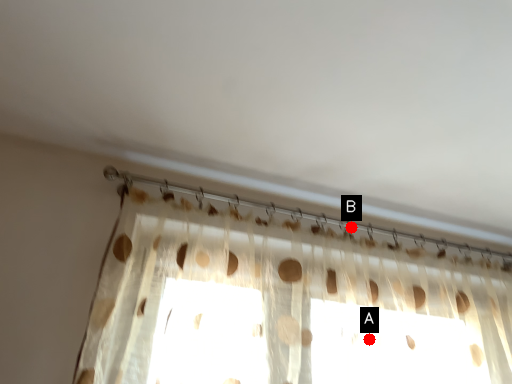
Question: Two points are circled on the image, labeled by A and B beside each circle. Which of the following is the farthest from the observer?

Choices:
 (A) A is further
 (B) B is further

Answer: (B)